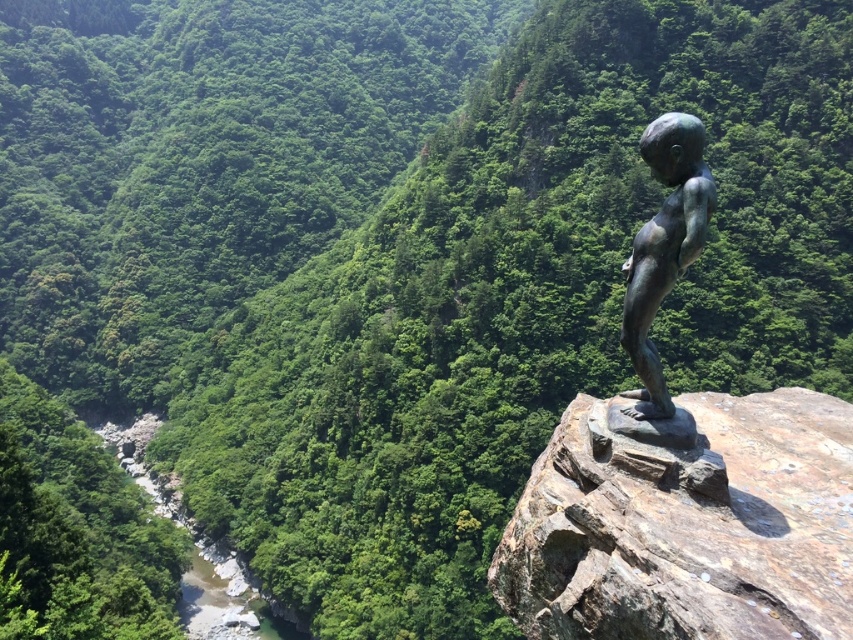
Measure the distance between point (811, 552) and camera.

Point (811, 552) is 12.01 meters away from camera.

Is rusty metallic statue at upper right taller than bronze statue at center?

No, rusty metallic statue at upper right is not taller than bronze statue at center.

I want to click on rusty metallic statue at upper right, so click(686, 524).

Find the location of a particular element. The image size is (853, 640). rusty metallic statue at upper right is located at coordinates (686, 524).